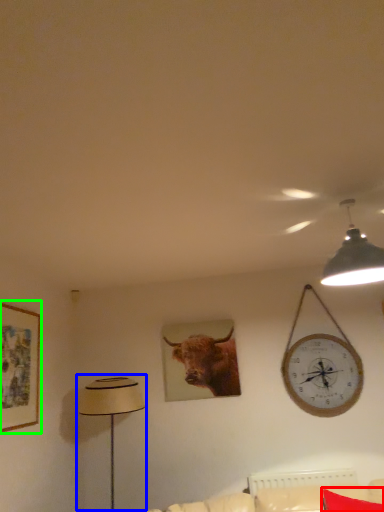
Question: Which object is positioned closest to pillow (highlighted by a red box)? Select from table lamp (highlighted by a blue box) and picture frame (highlighted by a green box).

Choices:
 (A) table lamp
 (B) picture frame

Answer: (A)